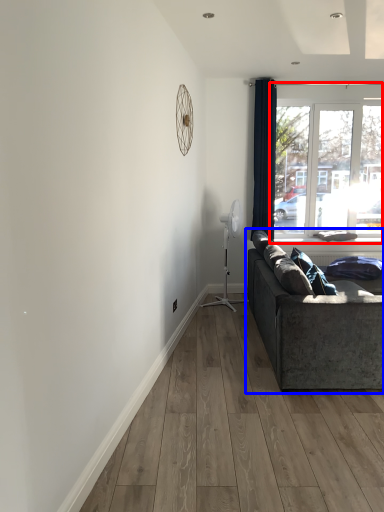
Question: Among these objects, which one is nearest to the camera, window (highlighted by a red box) or studio couch (highlighted by a blue box)?

Choices:
 (A) window
 (B) studio couch

Answer: (B)